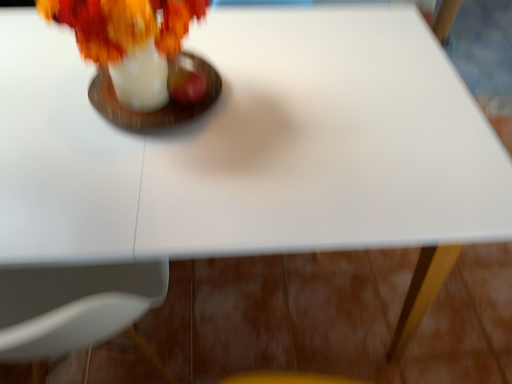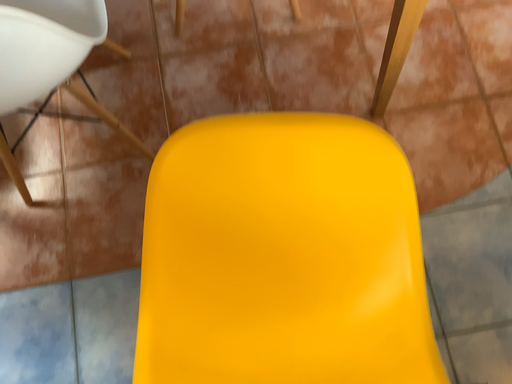
Question: Which way did the camera rotate in the video?

Choices:
 (A) rotated downward
 (B) rotated upward

Answer: (A)